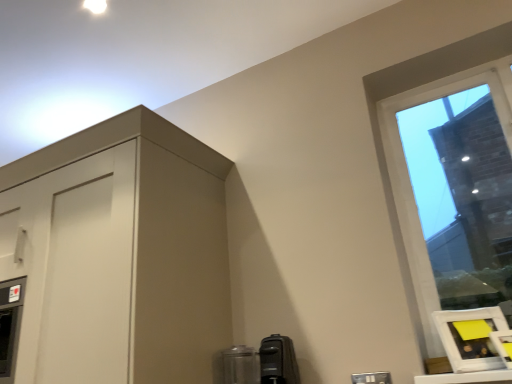
Describe the element at coordinates (470, 337) in the screenshot. I see `white matte picture frame at lower right` at that location.

Measure the distance between point [263,351] and camera.

The depth of point [263,351] is 1.54 meters.

How much space does black plastic coffee maker at lower center, the 2th appliance viewed from the left, occupy vertically?

black plastic coffee maker at lower center, the 2th appliance viewed from the left, is 8.14 inches tall.

Describe the element at coordinates (240, 365) in the screenshot. I see `satin black coffee maker at lower center, the 1th appliance positioned from the left` at that location.

At what (x,y) coordinates should I click in order to perform the action: click on matte white cabinet at upper left. Please return your answer as a coordinate pair (x, y). The height and width of the screenshot is (384, 512). Looking at the image, I should click on (116, 256).

Identify the location of white matte picture frame at lower right. (470, 337).

From the picture: Is white matte picture frame at lower right completely or partially inside matte white cabinet at upper left?

No, white matte picture frame at lower right is not a part of matte white cabinet at upper left.

Is matte white cabinet at upper left looking in the opposite direction of white matte picture frame at lower right?

matte white cabinet at upper left is not turned away from white matte picture frame at lower right.

From the picture: Is matte white cabinet at upper left further to camera compared to white matte picture frame at lower right?

No.

Which object is wider, matte white cabinet at upper left or white matte picture frame at lower right?

matte white cabinet at upper left is wider.

From a real-world perspective, relative to matte white cabinet at upper left, is satin black coffee maker at lower center, acting as the 2th appliance starting from the right, vertically above or below?

satin black coffee maker at lower center, acting as the 2th appliance starting from the right, is below matte white cabinet at upper left.

Which object is closer to the camera taking this photo, satin black coffee maker at lower center, acting as the 2th appliance starting from the right, or matte white cabinet at upper left?

matte white cabinet at upper left is closer to the camera.

Is satin black coffee maker at lower center, the 1th appliance positioned from the left, aimed at matte white cabinet at upper left?

No.

Which of these two, black plastic coffee maker at lower center, the 1th appliance viewed from the right, or matte white cabinet at upper left, is bigger?

With larger size is matte white cabinet at upper left.

Is matte white cabinet at upper left located within black plastic coffee maker at lower center, the 2th appliance viewed from the left?

No, matte white cabinet at upper left is not surrounded by black plastic coffee maker at lower center, the 2th appliance viewed from the left.

From a real-world perspective, is black plastic coffee maker at lower center, the 2th appliance viewed from the left, located higher than matte white cabinet at upper left?

No, from a real-world perspective, black plastic coffee maker at lower center, the 2th appliance viewed from the left, is not on top of matte white cabinet at upper left.

Which is correct: matte white cabinet at upper left is inside black plastic coffee maker at lower center, the 2th appliance viewed from the left, or outside of it?

matte white cabinet at upper left is spatially situated outside black plastic coffee maker at lower center, the 2th appliance viewed from the left.

Is the surface of matte white cabinet at upper left in direct contact with black plastic coffee maker at lower center, the 1th appliance viewed from the right?

matte white cabinet at upper left and black plastic coffee maker at lower center, the 1th appliance viewed from the right, are not in contact.

Which is closer, (228, 268) or (275, 361)?

The point (275, 361) is more forward.

Looking at this image, from the image's perspective, between matte white cabinet at upper left and black plastic coffee maker at lower center, the 1th appliance viewed from the right, which one is located above?

From the image's view, matte white cabinet at upper left is above.

How much distance is there between black plastic coffee maker at lower center, the 1th appliance viewed from the right, and clear glass window at upper right?

black plastic coffee maker at lower center, the 1th appliance viewed from the right, is 83.85 centimeters away from clear glass window at upper right.

From a real-world perspective, relative to clear glass window at upper right, is black plastic coffee maker at lower center, the 1th appliance viewed from the right, vertically above or below?

Clearly, from a real-world perspective, black plastic coffee maker at lower center, the 1th appliance viewed from the right, is below clear glass window at upper right.

Image resolution: width=512 pixels, height=384 pixels. I want to click on window in front of the black plastic coffee maker at lower center, the 1th appliance viewed from the right, so click(410, 180).

Considering the positions of points (286, 361) and (411, 268), is point (286, 361) farther from camera compared to point (411, 268)?

No, (286, 361) is in front of (411, 268).

Is black plastic coffee maker at lower center, the 1th appliance viewed from the right, at the back of white matte picture frame at lower right?

No.

Which is farther from the camera, (451,315) or (291,378)?

Positioned behind is point (451,315).

Locate an element on the screen. Image resolution: width=512 pixels, height=384 pixels. picture frame that is on the right side of black plastic coffee maker at lower center, the 1th appliance viewed from the right is located at coordinates [470, 337].

Which object is further away from the camera taking this photo, clear glass window at upper right or white matte picture frame at lower right?

clear glass window at upper right is further away from the camera.

Which of these two, clear glass window at upper right or white matte picture frame at lower right, stands shorter?

white matte picture frame at lower right.

How many degrees apart are the facing directions of clear glass window at upper right and white matte picture frame at lower right?

clear glass window at upper right and white matte picture frame at lower right are facing 38.5 degrees away from each other.

Between point (432, 278) and point (500, 316), which one is positioned behind?

The point (432, 278) is farther from the camera.

Locate an element on the screen. The height and width of the screenshot is (384, 512). dresser above the white matte picture frame at lower right (from a real-world perspective) is located at coordinates (116, 256).

I want to click on appliance that is the 2nd one when counting backward from the matte white cabinet at upper left, so click(x=240, y=365).

Looking at the image, which one is located closer to white matte picture frame at lower right, matte white cabinet at upper left or clear glass window at upper right?

Based on the image, clear glass window at upper right appears to be nearer to white matte picture frame at lower right.

Looking at the image, which one is located closer to satin black coffee maker at lower center, acting as the 2th appliance starting from the right, black plastic coffee maker at lower center, the 2th appliance viewed from the left, or white matte picture frame at lower right?

Among the two, black plastic coffee maker at lower center, the 2th appliance viewed from the left, is located nearer to satin black coffee maker at lower center, acting as the 2th appliance starting from the right.

Considering their positions, is satin black coffee maker at lower center, the 1th appliance positioned from the left, positioned closer to clear glass window at upper right than matte white cabinet at upper left?

satin black coffee maker at lower center, the 1th appliance positioned from the left.

Considering their positions, is white matte picture frame at lower right positioned closer to satin black coffee maker at lower center, acting as the 2th appliance starting from the right, than clear glass window at upper right?

white matte picture frame at lower right is positioned closer to the anchor satin black coffee maker at lower center, acting as the 2th appliance starting from the right.

Looking at the image, which one is located closer to satin black coffee maker at lower center, the 1th appliance positioned from the left, matte white cabinet at upper left or white matte picture frame at lower right?

matte white cabinet at upper left is closer to satin black coffee maker at lower center, the 1th appliance positioned from the left.

From the image, which object appears to be farther from satin black coffee maker at lower center, the 1th appliance positioned from the left, white matte picture frame at lower right or matte white cabinet at upper left?

The object further to satin black coffee maker at lower center, the 1th appliance positioned from the left, is white matte picture frame at lower right.

From the image, which object appears to be nearer to satin black coffee maker at lower center, the 1th appliance positioned from the left, black plastic coffee maker at lower center, the 2th appliance viewed from the left, or clear glass window at upper right?

black plastic coffee maker at lower center, the 2th appliance viewed from the left, is positioned closer to the anchor satin black coffee maker at lower center, the 1th appliance positioned from the left.

Looking at the image, which one is located closer to black plastic coffee maker at lower center, the 1th appliance viewed from the right, satin black coffee maker at lower center, acting as the 2th appliance starting from the right, or clear glass window at upper right?

satin black coffee maker at lower center, acting as the 2th appliance starting from the right, lies closer to black plastic coffee maker at lower center, the 1th appliance viewed from the right, than the other object.

Where is `picture frame between matte white cabinet at upper left and clear glass window at upper right from left to right`? The width and height of the screenshot is (512, 384). picture frame between matte white cabinet at upper left and clear glass window at upper right from left to right is located at coordinates (470, 337).

Identify the location of appliance between matte white cabinet at upper left and black plastic coffee maker at lower center, the 2th appliance viewed from the left. The width and height of the screenshot is (512, 384). (240, 365).

Find the location of a particular element. picture frame between satin black coffee maker at lower center, the 1th appliance positioned from the left, and clear glass window at upper right, in the horizontal direction is located at coordinates (470, 337).

What are the coordinates of `appliance between satin black coffee maker at lower center, acting as the 2th appliance starting from the right, and clear glass window at upper right` in the screenshot? It's located at (278, 361).